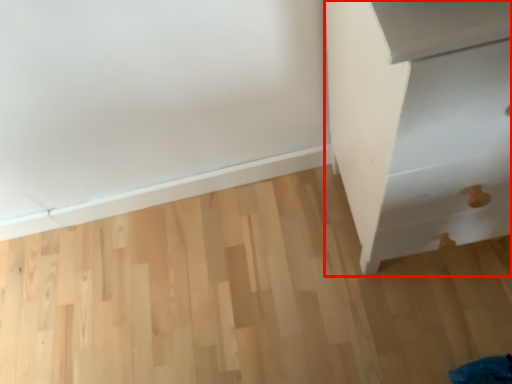
Question: Where is furniture (annotated by the red box) located in relation to plywood in the image?

Choices:
 (A) left
 (B) right

Answer: (B)